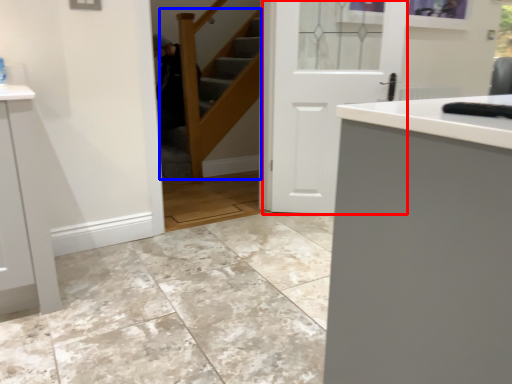
Question: Which object is further to the camera taking this photo, door (highlighted by a red box) or stairwell (highlighted by a blue box)?

Choices:
 (A) door
 (B) stairwell

Answer: (A)